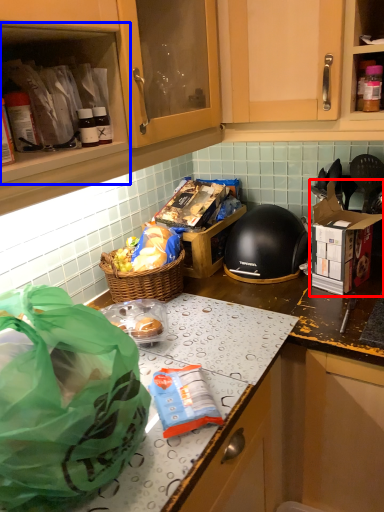
Question: Which object is closer to the camera taking this photo, cardboard box (highlighted by a red box) or cabinetry (highlighted by a blue box)?

Choices:
 (A) cardboard box
 (B) cabinetry

Answer: (B)